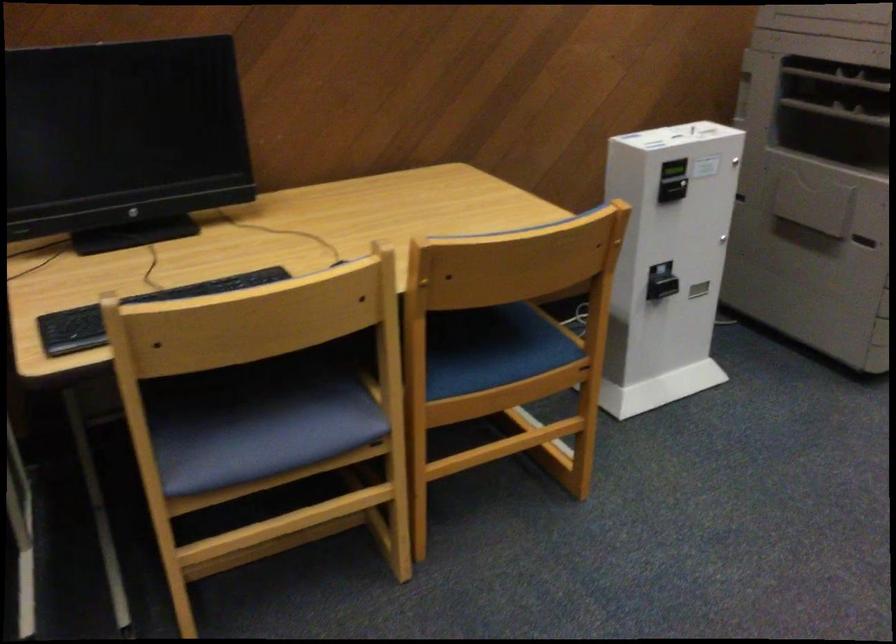
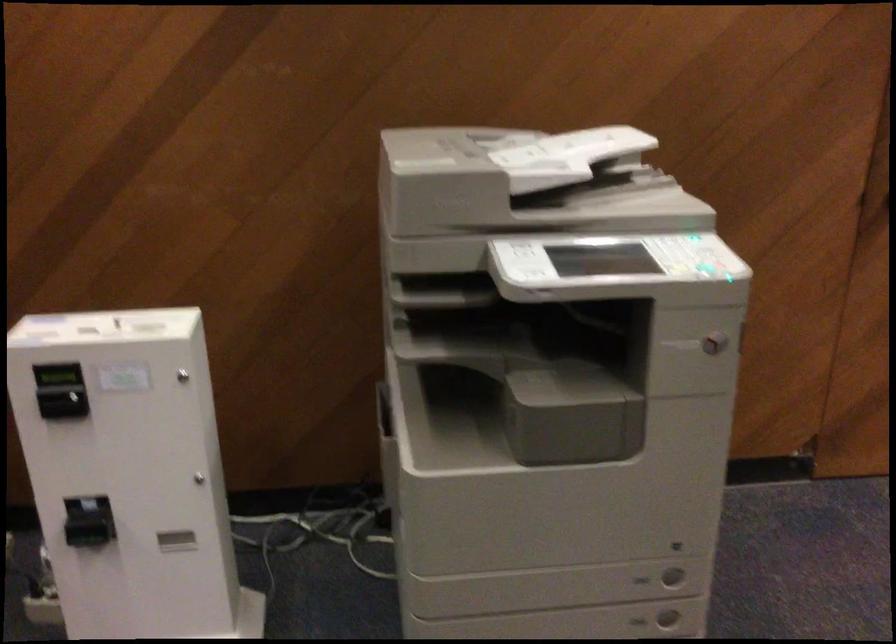
Find the pixel in the second image that matches the point at 661,166 in the first image.

(56, 375)